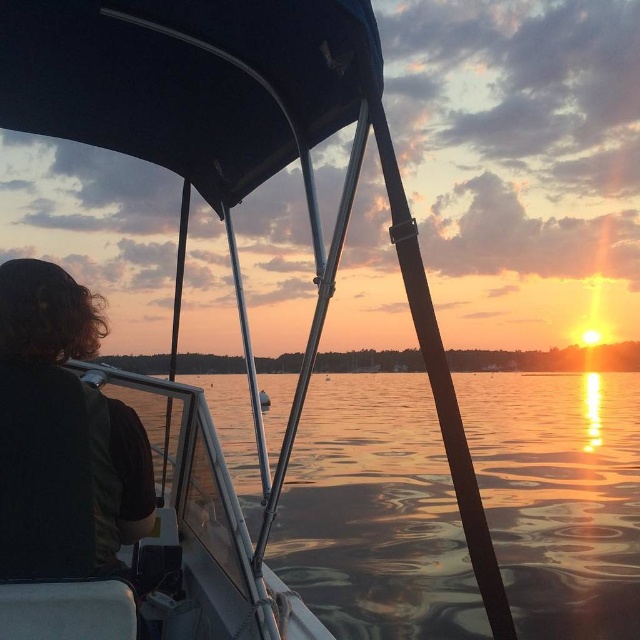
Question: Is the position of glistening water at center more distant than that of dark brown hair at left?

Choices:
 (A) yes
 (B) no

Answer: (A)

Question: Can you confirm if glistening water at center is positioned below dark brown hair at left?

Choices:
 (A) no
 (B) yes

Answer: (B)

Question: Can you confirm if glistening water at center is positioned above dark brown hair at left?

Choices:
 (A) no
 (B) yes

Answer: (A)

Question: Which of the following is the farthest from the observer?

Choices:
 (A) (513, 432)
 (B) (19, 458)

Answer: (A)

Question: Which object is farther from the camera taking this photo?

Choices:
 (A) dark brown hair at left
 (B) glistening water at center

Answer: (B)